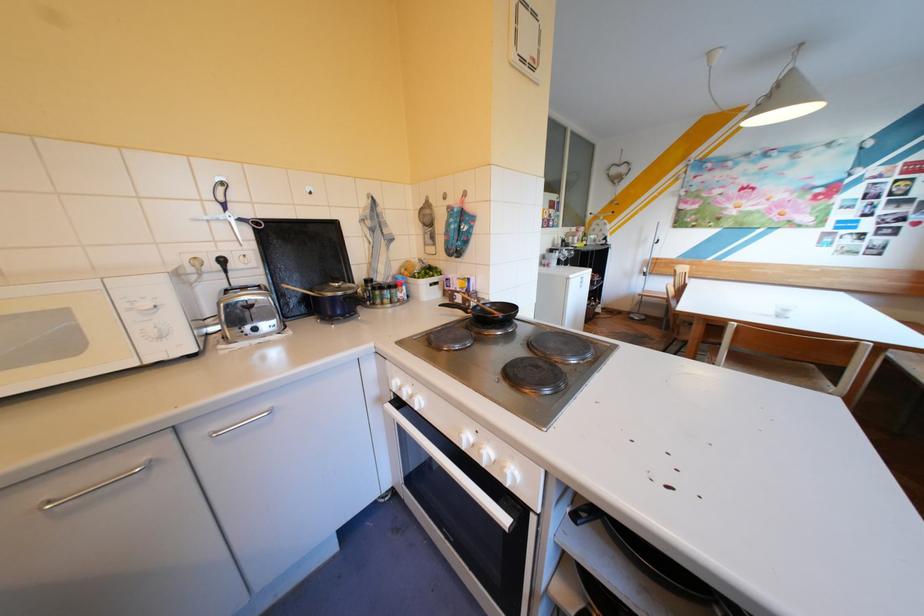
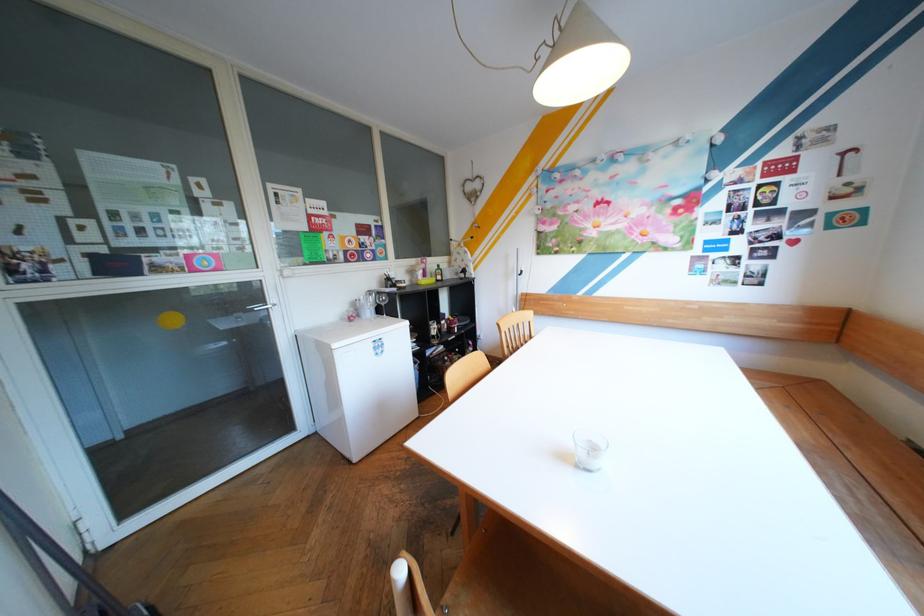
Locate, in the second image, the point that corresponds to point 590,237 in the first image.

(434, 270)